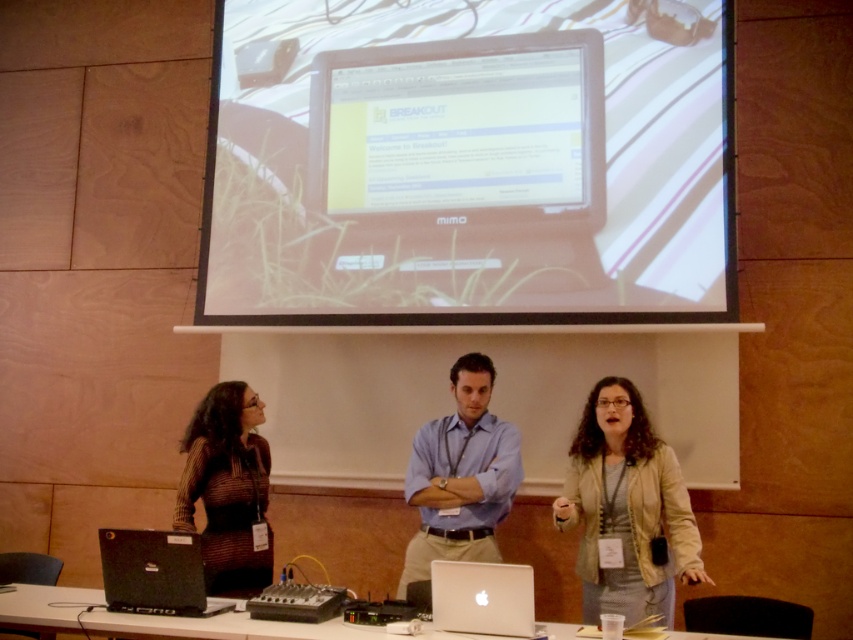
Question: Does white glossy screen at upper center appear under white glossy table at lower center?

Choices:
 (A) yes
 (B) no

Answer: (B)

Question: Is light beige jacket at center to the left of brown striped shirt at left from the viewer's perspective?

Choices:
 (A) no
 (B) yes

Answer: (A)

Question: Is blue shirt at center bigger than black matte laptop at lower left?

Choices:
 (A) no
 (B) yes

Answer: (B)

Question: Which of the following is the farthest from the observer?

Choices:
 (A) blue shirt at center
 (B) black matte laptop at lower left

Answer: (A)

Question: Which of the following is the farthest from the observer?

Choices:
 (A) (80, 588)
 (B) (444, 570)

Answer: (A)

Question: Which object appears closest to the camera in this image?

Choices:
 (A) black plastic mixer at center
 (B) matte black monitor at upper center

Answer: (A)